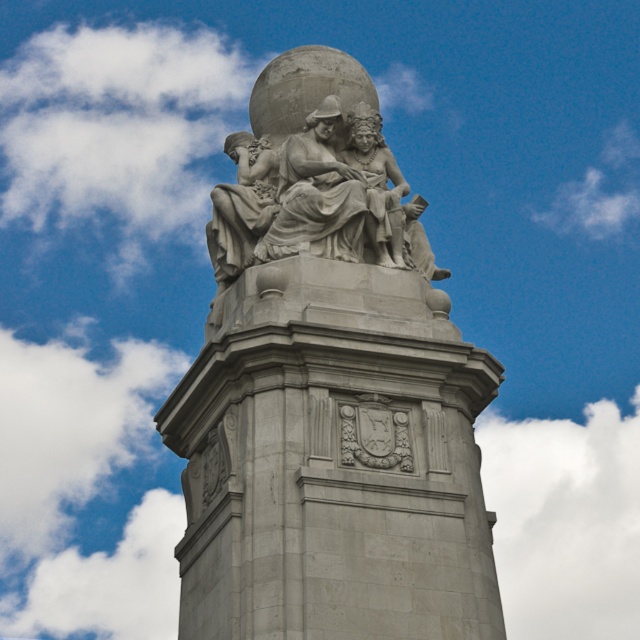
You are standing in front of the monument and want to take a photo that includes both the gray stone statue at center and the white fluffy cloud at upper left. Which object will appear larger in the photo?

The gray stone statue at center will appear larger in the photo because it is much taller than the white fluffy cloud at upper left.

You are standing at the monument and want to place a small flag at the point closer to you. Which point should you choose between point [433,573] and point [68,364]?

Point [433,573] is in front of point [68,364], so you should choose point [433,573] to place the flag closer to you.

You are a drone operator tasked with capturing aerial footage of the gray stone statue at center and the white fluffy cloud at upper right. Your drone has a maximum range of 40 meters. Can your drone safely capture footage of both objects without exceeding its range?

The gray stone statue at center is 38.19 meters away from the white fluffy cloud at upper right. Since the drone has a maximum range of 40 meters, it can safely capture footage of both objects as the distance between them is within the drone operator s range limit.